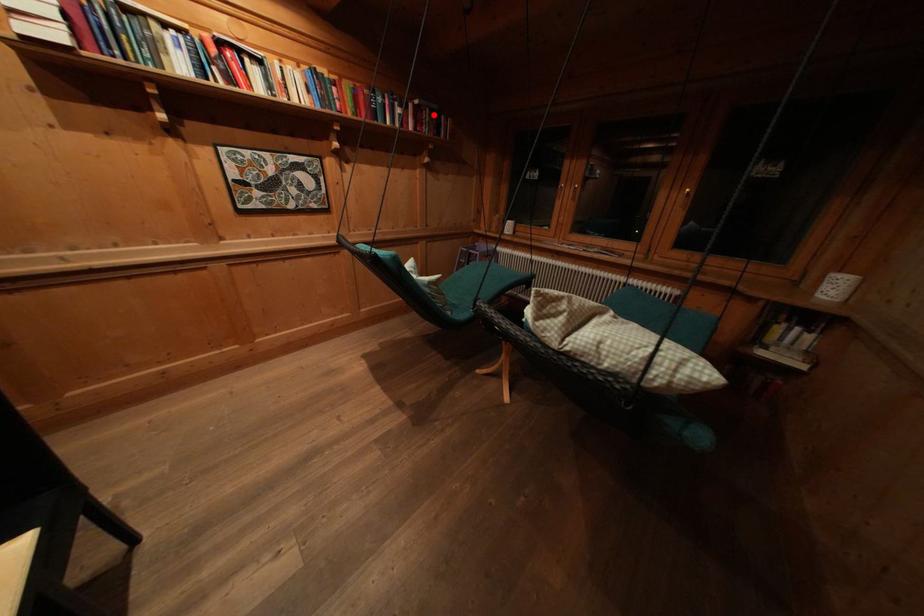
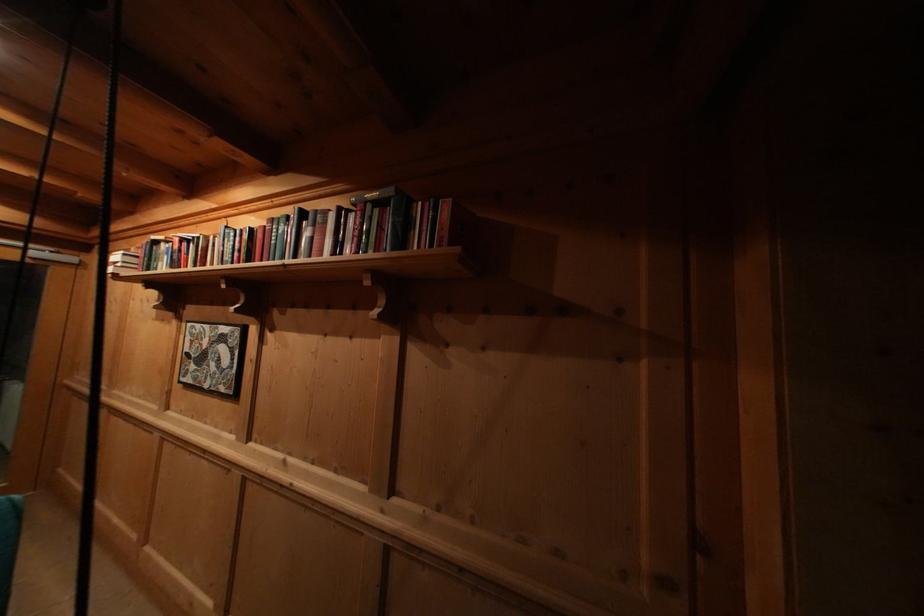
The point at the highlighted location is marked in the first image. Where is the corresponding point in the second image?

(375, 211)